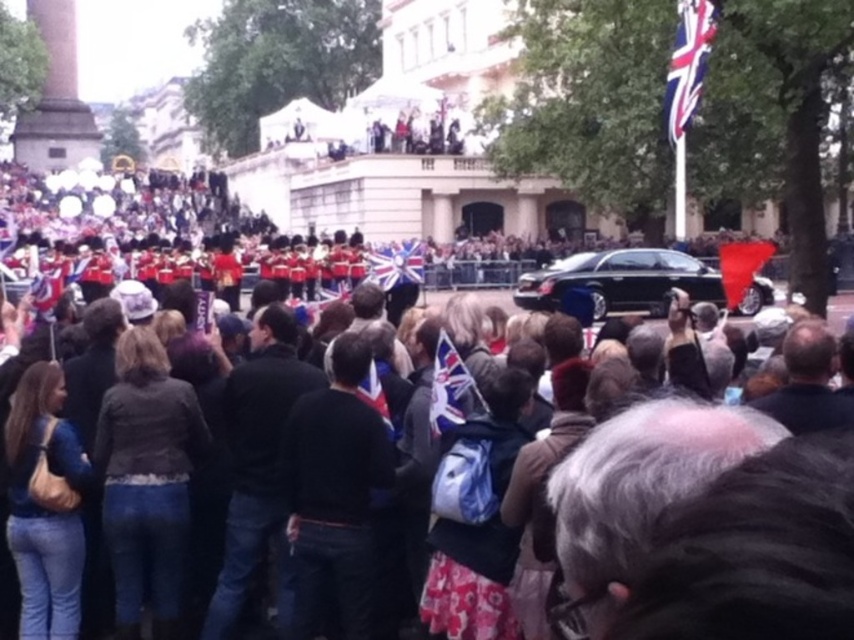
Is red fabric flag at right thinner than red fabric flag at center?

Incorrect, red fabric flag at right's width is not less than red fabric flag at center's.

Does red fabric flag at right appear on the right side of red fabric flag at center?

Correct, you'll find red fabric flag at right to the right of red fabric flag at center.

Measure the distance between red fabric flag at right and camera.

The distance of red fabric flag at right from camera is 273.53 feet.

Find the location of a particular element. The width and height of the screenshot is (854, 640). red fabric flag at right is located at coordinates (741, 266).

Is dark brown leather jacket at center wider than black glossy car at center?

Correct, the width of dark brown leather jacket at center exceeds that of black glossy car at center.

Locate an element on the screen. This screenshot has height=640, width=854. dark brown leather jacket at center is located at coordinates (115, 236).

Does dark brown leather jacket at center lie in front of red fabric flag at right?

Yes.

Which of these two, dark brown leather jacket at center or red fabric flag at right, stands shorter?

With less height is red fabric flag at right.

Is point (127, 179) positioned in front of point (750, 243)?

No, (127, 179) is behind (750, 243).

Find the location of a particular element. This screenshot has height=640, width=854. dark brown leather jacket at center is located at coordinates (115, 236).